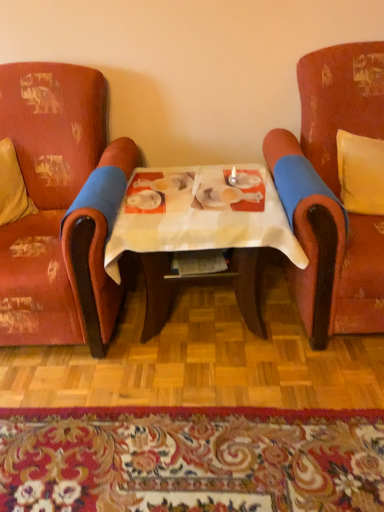
Describe the element at coordinates (12, 186) in the screenshot. The image size is (384, 512). I see `beige fabric pillow at left, which appears as the 1th pillow when viewed from the left` at that location.

Locate an element on the screen. The width and height of the screenshot is (384, 512). distressed red fabric armchair at left, the second chair in the right-to-left sequence is located at coordinates (60, 206).

In order to click on floral carpet at lower center in this screenshot , I will do `click(191, 459)`.

Locate an element on the screen. The width and height of the screenshot is (384, 512). chair above the distressed red fabric armchair at left, positioned as the first chair in left-to-right order (from the image's perspective) is located at coordinates (332, 192).

Can you confirm if velvet-like red armchair at right, the 1th chair from the right, is shorter than distressed red fabric armchair at left, the second chair in the right-to-left sequence?

No.

Is velvet-like red armchair at right, which is counted as the second chair, starting from the left, next to distressed red fabric armchair at left, positioned as the first chair in left-to-right order?

velvet-like red armchair at right, which is counted as the second chair, starting from the left, and distressed red fabric armchair at left, positioned as the first chair in left-to-right order, are clearly separated.

Can you tell me how much floral carpet at lower center and yellow fabric pillow at right, which is the second pillow in left-to-right order, differ in facing direction?

The angle between the facing direction of floral carpet at lower center and the facing direction of yellow fabric pillow at right, which is the second pillow in left-to-right order, is 98.5 degrees.

Which is more distant, (328, 424) or (354, 175)?

The point (354, 175) is behind.

This screenshot has width=384, height=512. I want to click on mat on the left of yellow fabric pillow at right, which is the second pillow in left-to-right order, so click(191, 459).

Are floral carpet at lower center and yellow fabric pillow at right, which is the second pillow in left-to-right order, making contact?

No, floral carpet at lower center is not touching yellow fabric pillow at right, which is the second pillow in left-to-right order.

Would you say floral carpet at lower center is outside velvet-like red armchair at right, the 1th chair from the right?

That's correct, floral carpet at lower center is outside of velvet-like red armchair at right, the 1th chair from the right.

From a real-world perspective, is floral carpet at lower center physically above velvet-like red armchair at right, which is counted as the second chair, starting from the left?

No, from a real-world perspective, floral carpet at lower center is not on top of velvet-like red armchair at right, which is counted as the second chair, starting from the left.

Which is less distant, [250,423] or [372,47]?

Point [250,423] appears to be closer to the viewer than point [372,47].

You are a GUI agent. You are given a task and a screenshot of the screen. Output one action in this format:
    pyautogui.click(x=<x>, y=<y>)
    Task: Click on the mat lying on the left of velvet-like red armchair at right, which is counted as the second chair, starting from the left
    Image resolution: width=384 pixels, height=512 pixels.
    Given the screenshot: What is the action you would take?
    pyautogui.click(x=191, y=459)

From the image's perspective, relative to beige fabric pillow at left, placed as the 2th pillow when sorted from right to left, is yellow fabric pillow at right, which is the second pillow in left-to-right order, above or below?

From the image's perspective, yellow fabric pillow at right, which is the second pillow in left-to-right order, appears above beige fabric pillow at left, placed as the 2th pillow when sorted from right to left.

From a real-world perspective, is yellow fabric pillow at right, the 1th pillow in the right-to-left sequence, on beige fabric pillow at left, placed as the 2th pillow when sorted from right to left?

Actually, yellow fabric pillow at right, the 1th pillow in the right-to-left sequence, is physically below beige fabric pillow at left, placed as the 2th pillow when sorted from right to left, in the real world.

Who is taller, yellow fabric pillow at right, which is the second pillow in left-to-right order, or beige fabric pillow at left, placed as the 2th pillow when sorted from right to left?

With more height is beige fabric pillow at left, placed as the 2th pillow when sorted from right to left.

Is yellow fabric pillow at right, the 1th pillow in the right-to-left sequence, positioned in front of beige fabric pillow at left, placed as the 2th pillow when sorted from right to left?

Yes, yellow fabric pillow at right, the 1th pillow in the right-to-left sequence, is closer to the viewer.

Which object is positioned more to the left, white paper table at center or velvet-like red armchair at right, the 1th chair from the right?

white paper table at center is more to the left.

Is white paper table at center oriented towards velvet-like red armchair at right, which is counted as the second chair, starting from the left?

No, white paper table at center is not aimed at velvet-like red armchair at right, which is counted as the second chair, starting from the left.

Can we say white paper table at center lies outside velvet-like red armchair at right, which is counted as the second chair, starting from the left?

That's correct, white paper table at center is outside of velvet-like red armchair at right, which is counted as the second chair, starting from the left.

From the picture: Could you tell me if white paper table at center is facing distressed red fabric armchair at left, positioned as the first chair in left-to-right order?

No, white paper table at center is not oriented towards distressed red fabric armchair at left, positioned as the first chair in left-to-right order.

Considering the relative positions of white paper table at center and distressed red fabric armchair at left, positioned as the first chair in left-to-right order, in the image provided, is white paper table at center to the left or to the right of distressed red fabric armchair at left, positioned as the first chair in left-to-right order,?

Based on their positions, white paper table at center is located to the right of distressed red fabric armchair at left, positioned as the first chair in left-to-right order.

Could distressed red fabric armchair at left, the second chair in the right-to-left sequence, be considered to be inside white paper table at center?

No, distressed red fabric armchair at left, the second chair in the right-to-left sequence, is not inside white paper table at center.

Who is bigger, white paper table at center or distressed red fabric armchair at left, the second chair in the right-to-left sequence?

With larger size is distressed red fabric armchair at left, the second chair in the right-to-left sequence.

Consider the image. From the image's perspective, would you say velvet-like red armchair at right, the 1th chair from the right, is positioned over yellow fabric pillow at right, which is the second pillow in left-to-right order?

No, from the image's perspective, velvet-like red armchair at right, the 1th chair from the right, is not above yellow fabric pillow at right, which is the second pillow in left-to-right order.

Between velvet-like red armchair at right, the 1th chair from the right, and yellow fabric pillow at right, which is the second pillow in left-to-right order, which one has smaller size?

yellow fabric pillow at right, which is the second pillow in left-to-right order.

Relative to yellow fabric pillow at right, which is the second pillow in left-to-right order, is velvet-like red armchair at right, which is counted as the second chair, starting from the left, in front or behind?

Visually, velvet-like red armchair at right, which is counted as the second chair, starting from the left, is located in front of yellow fabric pillow at right, which is the second pillow in left-to-right order.

Could you tell me if velvet-like red armchair at right, the 1th chair from the right, is facing yellow fabric pillow at right, which is the second pillow in left-to-right order?

Yes, velvet-like red armchair at right, the 1th chair from the right, is aimed at yellow fabric pillow at right, which is the second pillow in left-to-right order.

The width and height of the screenshot is (384, 512). Find the location of `chair that is below the velvet-like red armchair at right, which is counted as the second chair, starting from the left (from the image's perspective)`. chair that is below the velvet-like red armchair at right, which is counted as the second chair, starting from the left (from the image's perspective) is located at coordinates (60, 206).

Find the location of a particular element. The width and height of the screenshot is (384, 512). pillow that is the 2nd object located above the floral carpet at lower center (from the image's perspective) is located at coordinates (361, 173).

Consider the image. When comparing their distances from floral carpet at lower center, does velvet-like red armchair at right, the 1th chair from the right, or distressed red fabric armchair at left, positioned as the first chair in left-to-right order, seem further?

velvet-like red armchair at right, the 1th chair from the right, lies further to floral carpet at lower center than the other object.

Looking at the image, which one is located further to beige fabric pillow at left, placed as the 2th pillow when sorted from right to left, white paper table at center or floral carpet at lower center?

floral carpet at lower center lies further to beige fabric pillow at left, placed as the 2th pillow when sorted from right to left, than the other object.

Estimate the real-world distances between objects in this image. Which object is further from white paper table at center, yellow fabric pillow at right, the 1th pillow in the right-to-left sequence, or velvet-like red armchair at right, which is counted as the second chair, starting from the left?

yellow fabric pillow at right, the 1th pillow in the right-to-left sequence, is positioned further to the anchor white paper table at center.

When comparing their distances from white paper table at center, does yellow fabric pillow at right, the 1th pillow in the right-to-left sequence, or floral carpet at lower center seem further?

The object further to white paper table at center is floral carpet at lower center.

Based on their spatial positions, is distressed red fabric armchair at left, the second chair in the right-to-left sequence, or beige fabric pillow at left, placed as the 2th pillow when sorted from right to left, closer to floral carpet at lower center?

distressed red fabric armchair at left, the second chair in the right-to-left sequence.

Estimate the real-world distances between objects in this image. Which object is further from beige fabric pillow at left, which appears as the 1th pillow when viewed from the left, velvet-like red armchair at right, which is counted as the second chair, starting from the left, or yellow fabric pillow at right, which is the second pillow in left-to-right order?

yellow fabric pillow at right, which is the second pillow in left-to-right order, lies further to beige fabric pillow at left, which appears as the 1th pillow when viewed from the left, than the other object.

Which object lies nearer to the anchor point white paper table at center, beige fabric pillow at left, which appears as the 1th pillow when viewed from the left, or floral carpet at lower center?

Based on the image, floral carpet at lower center appears to be nearer to white paper table at center.

Looking at the image, which one is located further to floral carpet at lower center, white paper table at center or beige fabric pillow at left, placed as the 2th pillow when sorted from right to left?

beige fabric pillow at left, placed as the 2th pillow when sorted from right to left, is positioned further to the anchor floral carpet at lower center.

I want to click on table located between beige fabric pillow at left, placed as the 2th pillow when sorted from right to left, and yellow fabric pillow at right, the 1th pillow in the right-to-left sequence, in the left-right direction, so click(200, 229).

Locate an element on the screen. mat between distressed red fabric armchair at left, positioned as the first chair in left-to-right order, and velvet-like red armchair at right, which is counted as the second chair, starting from the left, from left to right is located at coordinates (191, 459).

The width and height of the screenshot is (384, 512). Identify the location of chair located between beige fabric pillow at left, which appears as the 1th pillow when viewed from the left, and white paper table at center in the left-right direction. coord(60,206).

Find the location of a particular element. Image resolution: width=384 pixels, height=512 pixels. mat located between distressed red fabric armchair at left, the second chair in the right-to-left sequence, and yellow fabric pillow at right, which is the second pillow in left-to-right order, in the left-right direction is located at coordinates (191, 459).